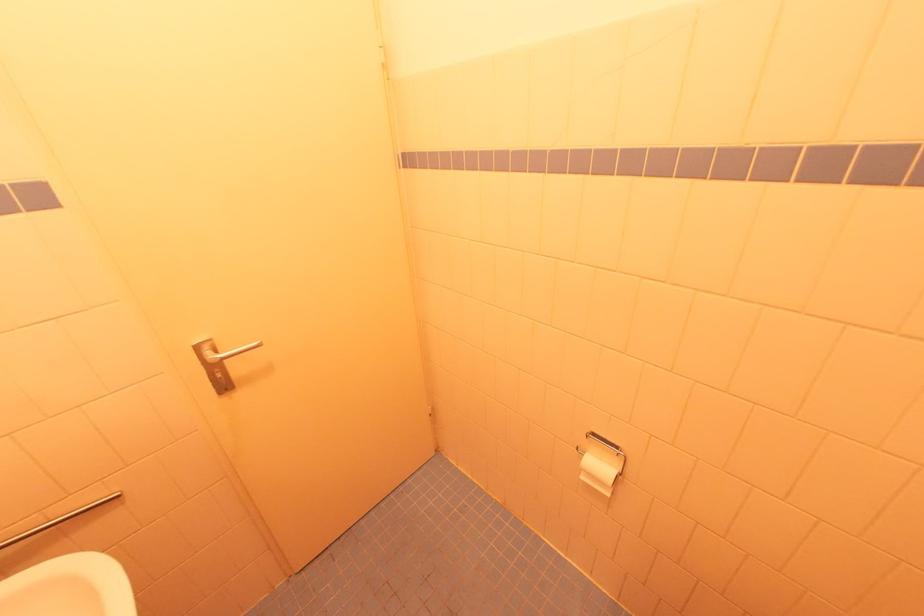
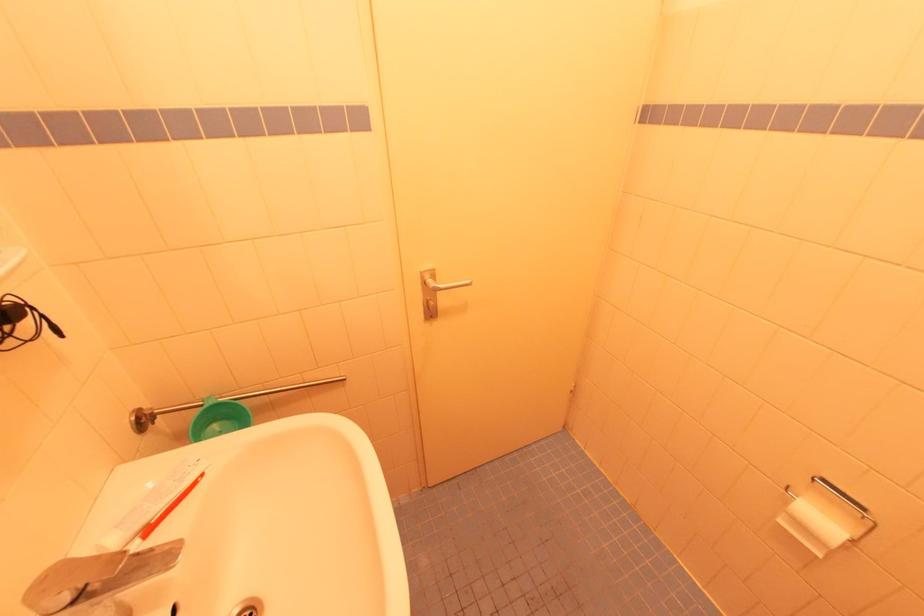
Find the pixel in the second image that matches point 197,345 in the first image.

(423, 272)